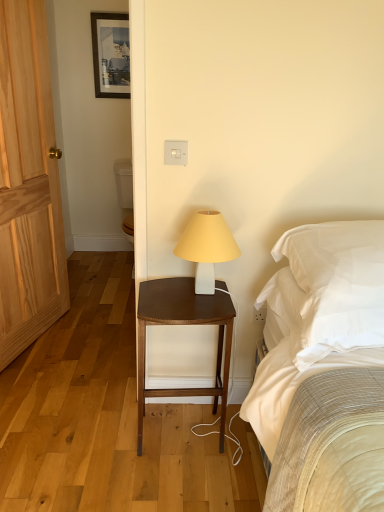
Question: Looking at the image, does brown wood nightstand at center seem bigger or smaller compared to white matte lamp at center?

Choices:
 (A) big
 (B) small

Answer: (A)

Question: Would you say brown wood nightstand at center is to the left or to the right of white matte lamp at center in the picture?

Choices:
 (A) left
 (B) right

Answer: (A)

Question: Estimate the real-world distances between objects in this image. Which object is closer to the light wood door at left?

Choices:
 (A) matte black picture frame at upper center
 (B) white soft pillow at right
 (C) white matte lamp at center
 (D) brown wood nightstand at center

Answer: (D)

Question: Which object is the closest to the brown wood nightstand at center?

Choices:
 (A) white soft pillow at right
 (B) matte black picture frame at upper center
 (C) white matte lamp at center
 (D) light wood door at left

Answer: (C)